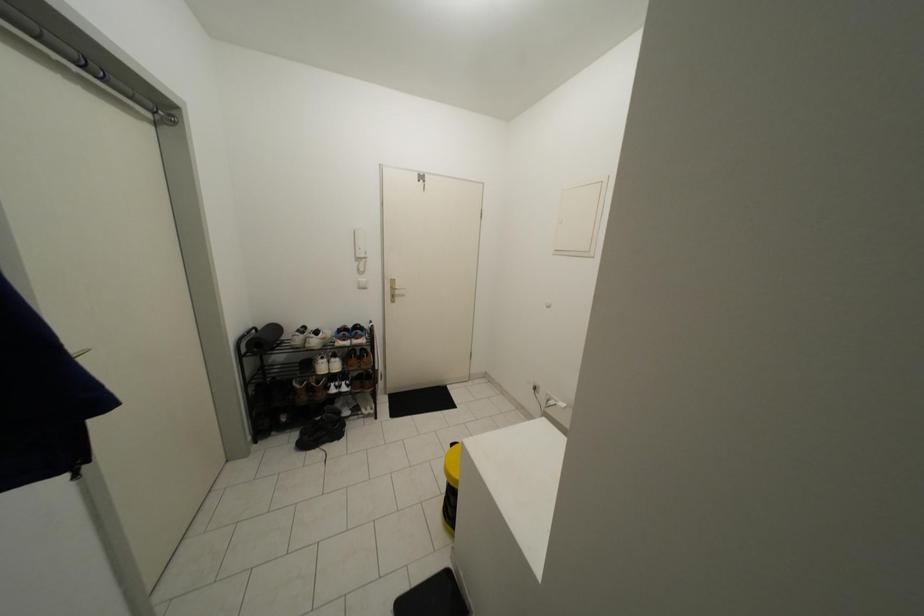
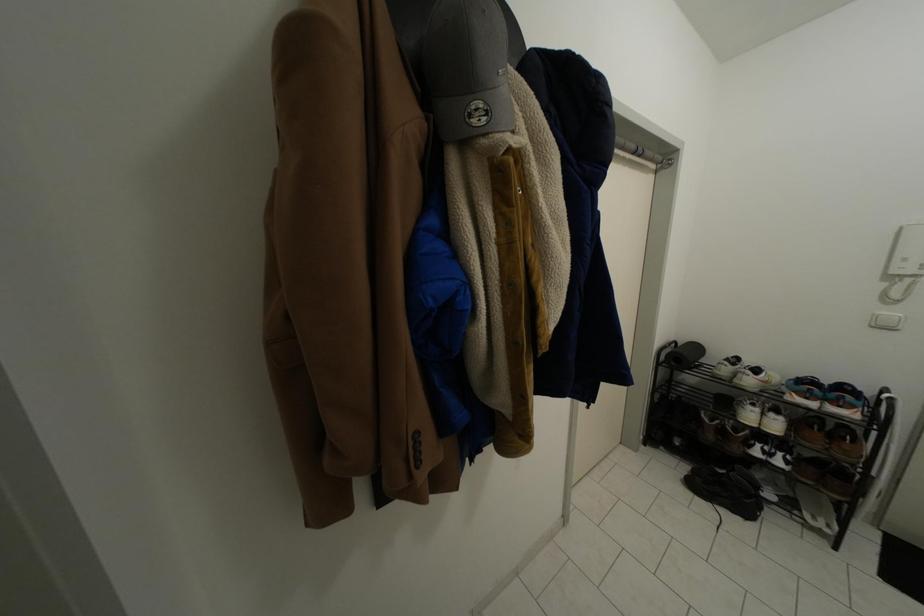
Question: The first image is from the beginning of the video and the second image is from the end. How did the camera likely rotate when shooting the video?

Choices:
 (A) Left
 (B) Right
 (C) Up
 (D) Down

Answer: (A)